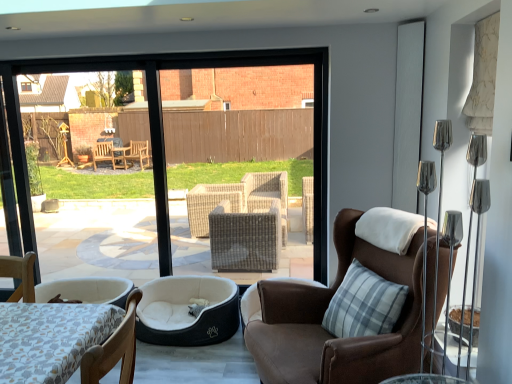
Question: From the image's perspective, is wooden chair at lower left, the 1th chair in the left-to-right sequence, above or below white textured screen door at upper right?

Choices:
 (A) below
 (B) above

Answer: (A)

Question: Considering the positions of wooden chair at lower left, the 2th chair positioned from the back, and white textured screen door at upper right in the image, is wooden chair at lower left, the 2th chair positioned from the back, taller or shorter than white textured screen door at upper right?

Choices:
 (A) short
 (B) tall

Answer: (A)

Question: Which object is positioned farthest from the white textured screen door at upper right?

Choices:
 (A) brown leather chair at center, marked as the first chair in a back-to-front arrangement
 (B) dark gray plush dog bed at lower left
 (C) wooden chair at lower left, the 2th chair positioned from the back

Answer: (C)

Question: Based on their relative distances, which object is farther from the dark gray plush dog bed at lower left?

Choices:
 (A) white textured screen door at upper right
 (B) brown leather chair at center, which is counted as the second chair, starting from the left
 (C) wooden chair at lower left, the 1th chair in the left-to-right sequence

Answer: (A)